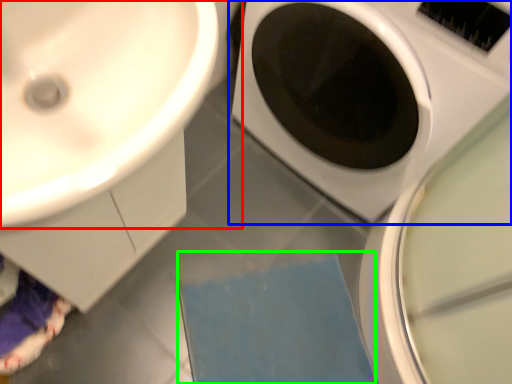
Question: Which object is positioned farthest from sink (highlighted by a red box)? Select from washing machine (highlighted by a blue box) and bath mat (highlighted by a green box).

Choices:
 (A) washing machine
 (B) bath mat

Answer: (B)